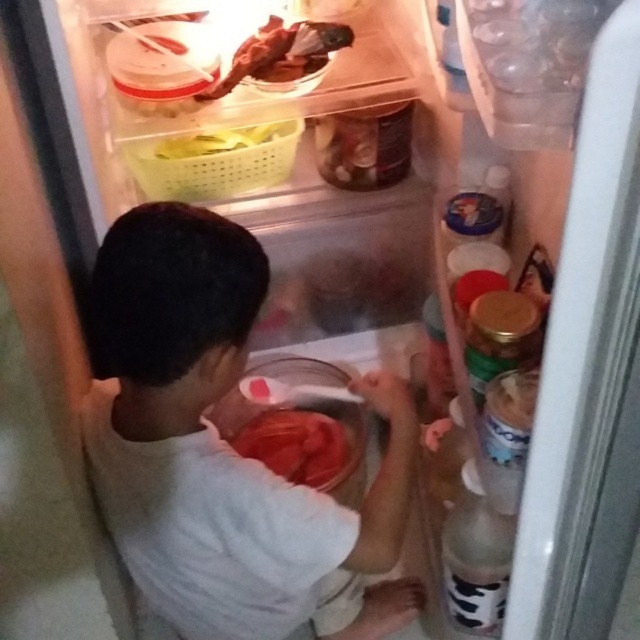
Question: Which object is the closest to the shiny red meat at center?

Choices:
 (A) shiny brown meat at upper left
 (B) white cotton shirt at center

Answer: (B)

Question: Is white cotton shirt at center further to the viewer compared to yellow plastic basket at upper left?

Choices:
 (A) no
 (B) yes

Answer: (A)

Question: Which point is closer to the camera?

Choices:
 (A) yellow plastic basket at upper left
 (B) white cotton shirt at center
 (C) shiny brown meat at upper left
 (D) shiny red meat at center

Answer: (B)

Question: From the image, what is the correct spatial relationship of white cotton shirt at center in relation to shiny brown meat at upper left?

Choices:
 (A) above
 (B) below

Answer: (B)

Question: Which of the following is the closest to the observer?

Choices:
 (A) (168, 467)
 (B) (339, 38)
 (C) (259, 128)

Answer: (A)

Question: Does shiny red meat at center appear under shiny brown meat at upper left?

Choices:
 (A) no
 (B) yes

Answer: (B)